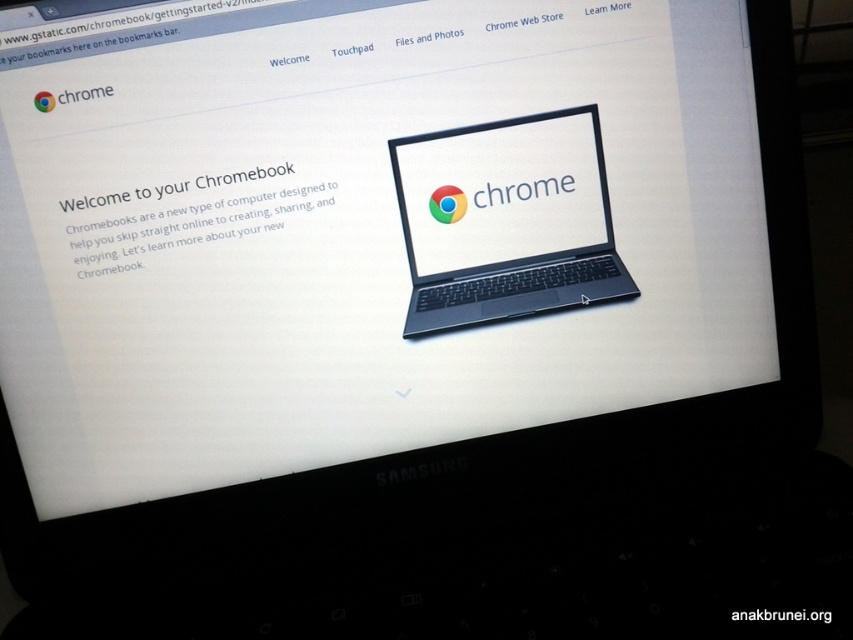
You are holding a ruler and want to measure the distance between the point at coordinates (419, 157) on the laptop screen and your eyes. Can you determine if the distance is more than 25 inches?

The point at coordinates (419, 157) is 25.27 inches away from the viewer, which is just over 25 inches. Therefore, the distance is more than 25 inches.

You are setting up a new Chromebook and have two laptops in front of you, a satin black laptop at center and a white glossy laptop at center. You need to choose the one with the wider screen to display a presentation. Which laptop should you pick?

The satin black laptop at center has a larger width than the white glossy laptop at center, so you should pick the satin black laptop at center for the wider screen to display your presentation.